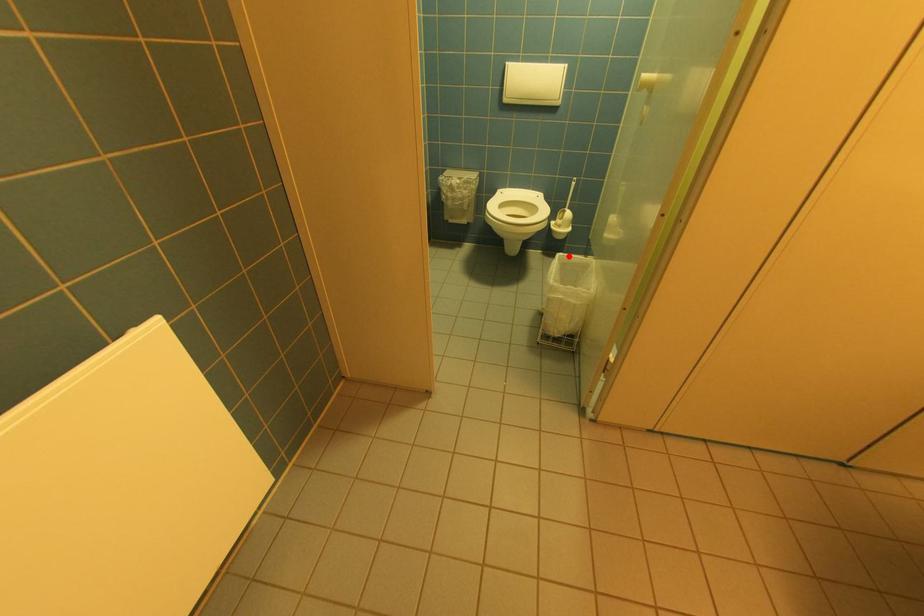
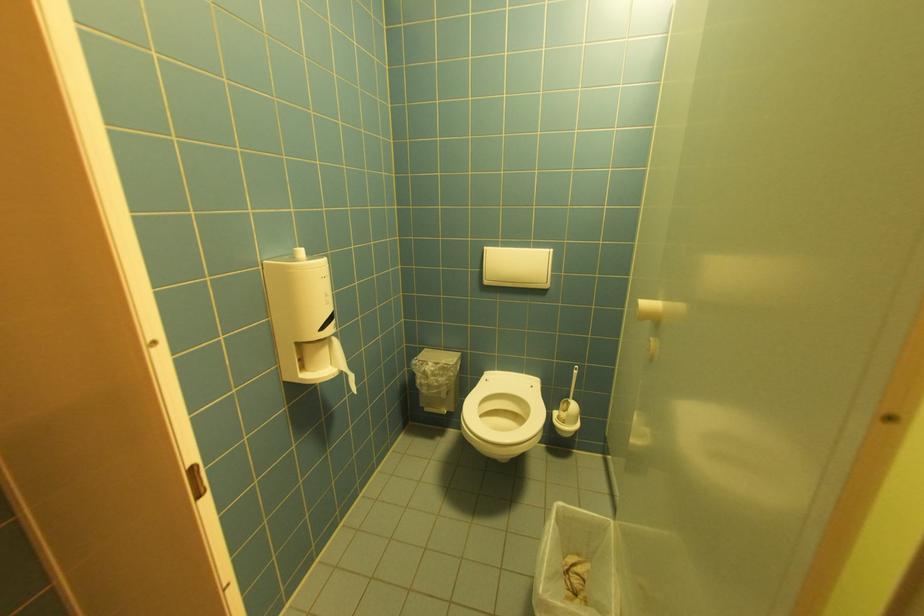
Find the pixel in the second image that matches the highlighted location in the first image.

(569, 507)